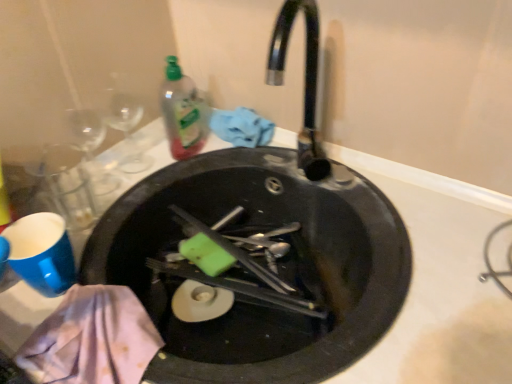
Question: Would you say translucent plastic bottle at upper center is part of black matte sink at center's contents?

Choices:
 (A) no
 (B) yes

Answer: (A)

Question: From the image's perspective, is black matte sink at center on translucent plastic bottle at upper center?

Choices:
 (A) no
 (B) yes

Answer: (A)

Question: Is black matte sink at center far from translucent plastic bottle at upper center?

Choices:
 (A) yes
 (B) no

Answer: (B)

Question: From the image's perspective, is black matte sink at center beneath translucent plastic bottle at upper center?

Choices:
 (A) no
 (B) yes

Answer: (B)

Question: From a real-world perspective, does black matte sink at center stand above translucent plastic bottle at upper center?

Choices:
 (A) no
 (B) yes

Answer: (A)

Question: Considering the relative sizes of black matte sink at center and translucent plastic bottle at upper center in the image provided, is black matte sink at center bigger than translucent plastic bottle at upper center?

Choices:
 (A) no
 (B) yes

Answer: (B)

Question: Is translucent plastic bottle at upper center far from black matte sink at center?

Choices:
 (A) no
 (B) yes

Answer: (A)

Question: From a real-world perspective, is translucent plastic bottle at upper center on top of black matte sink at center?

Choices:
 (A) yes
 (B) no

Answer: (A)

Question: Is translucent plastic bottle at upper center in contact with black matte sink at center?

Choices:
 (A) no
 (B) yes

Answer: (A)

Question: Can you confirm if translucent plastic bottle at upper center is smaller than black matte sink at center?

Choices:
 (A) yes
 (B) no

Answer: (A)

Question: Is translucent plastic bottle at upper center positioned before black matte sink at center?

Choices:
 (A) no
 (B) yes

Answer: (A)

Question: Can you confirm if translucent plastic bottle at upper center is thinner than black matte sink at center?

Choices:
 (A) yes
 (B) no

Answer: (A)

Question: Is black matte sink at center bigger or smaller than translucent plastic bottle at upper center?

Choices:
 (A) small
 (B) big

Answer: (B)